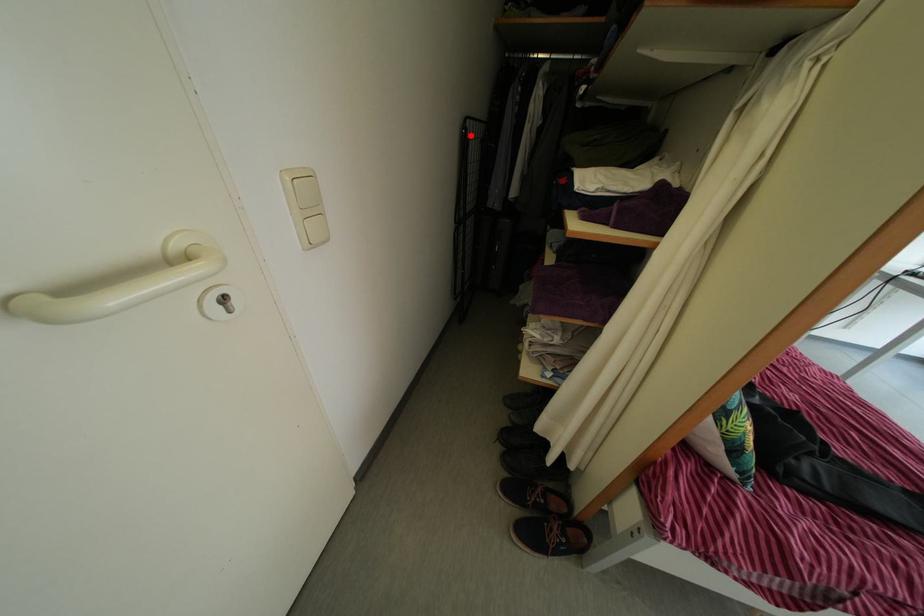
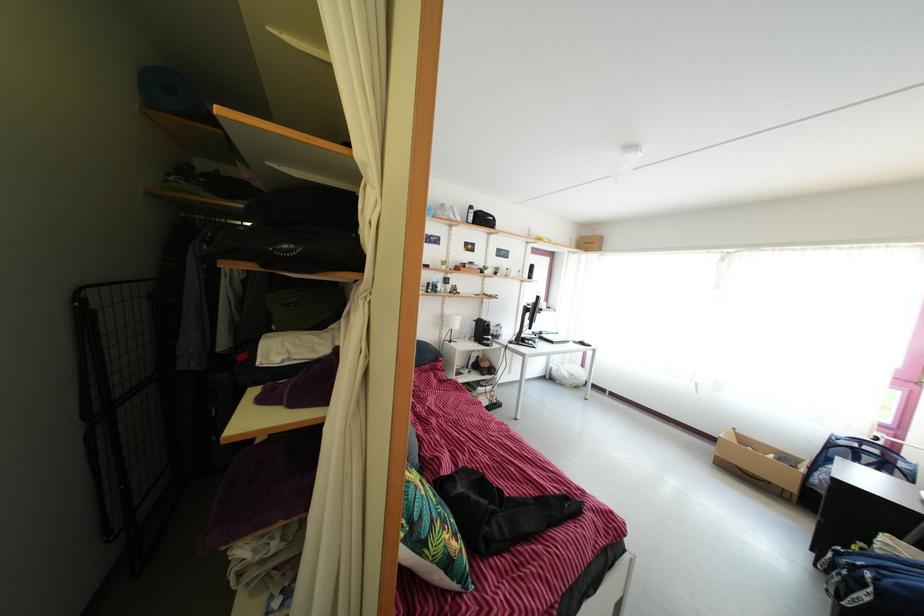
In the second image, find the point that corresponds to the highlighted location in the first image.

(86, 307)